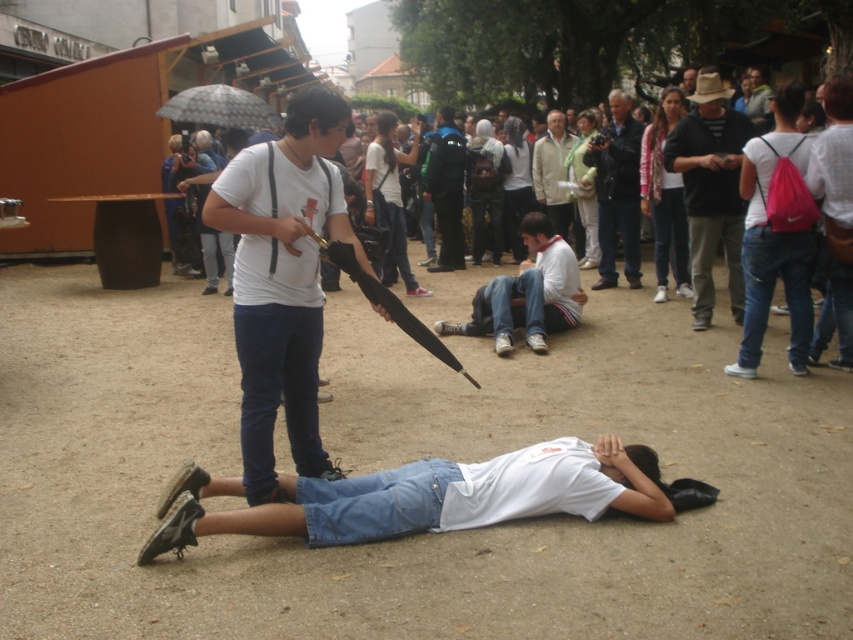
Question: Is black textured shirt at upper right positioned at the back of blue fabric jacket at center?

Choices:
 (A) no
 (B) yes

Answer: (A)

Question: Among these points, which one is farthest from the camera?

Choices:
 (A) (576, 308)
 (B) (548, 156)
 (C) (611, 212)

Answer: (B)

Question: Estimate the real-world distances between objects in this image. Which object is closer to the white matte shirt at center?

Choices:
 (A) blue fabric jacket at center
 (B) black textured shirt at upper right
 (C) dark blue jeans at center

Answer: (B)

Question: Is black textured shirt at upper right bigger than white cotton shirt at center?

Choices:
 (A) no
 (B) yes

Answer: (B)

Question: Which object appears farthest from the camera in this image?

Choices:
 (A) blue fabric jacket at center
 (B) dark blue jeans at center
 (C) black textured shirt at upper right

Answer: (A)

Question: Is black textured shirt at upper right to the left of light beige jacket at center from the viewer's perspective?

Choices:
 (A) no
 (B) yes

Answer: (A)